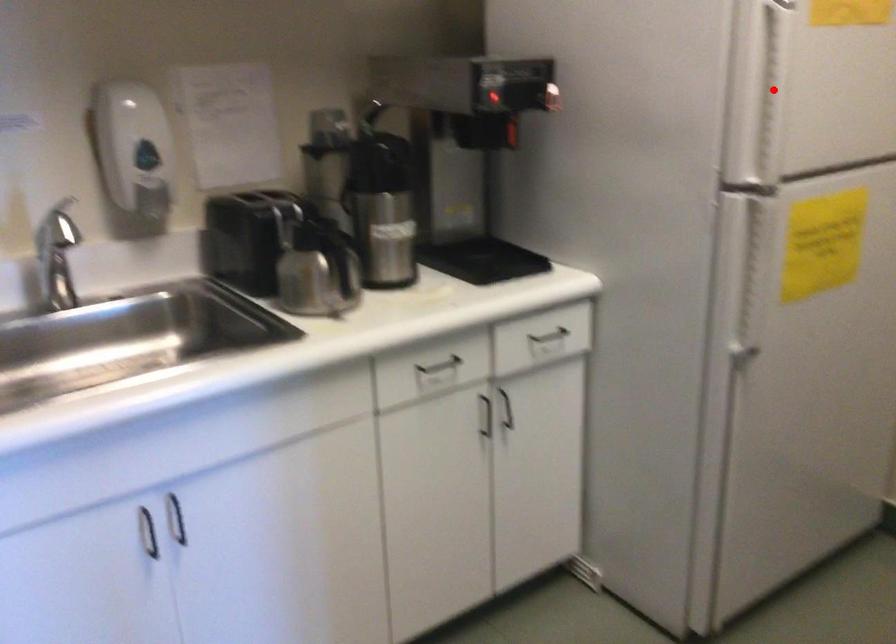
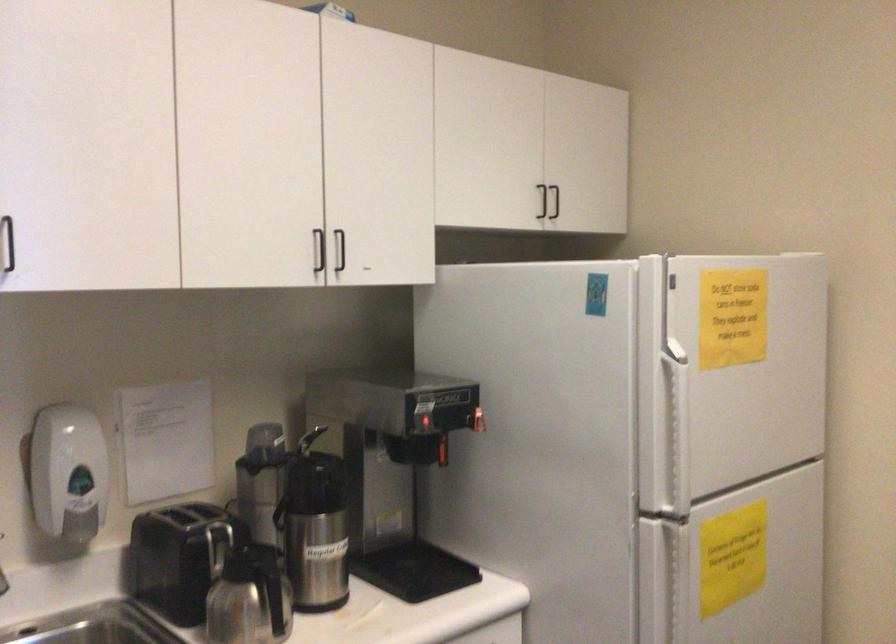
Locate, in the second image, the point that corresponds to the highlighted location in the first image.

(675, 431)